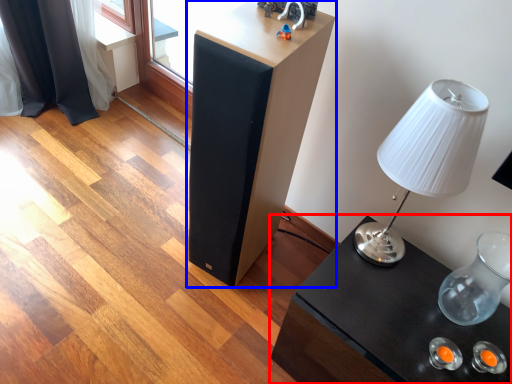
Question: Among these objects, which one is nearest to the camera, table (highlighted by a red box) or furniture (highlighted by a blue box)?

Choices:
 (A) table
 (B) furniture

Answer: (A)